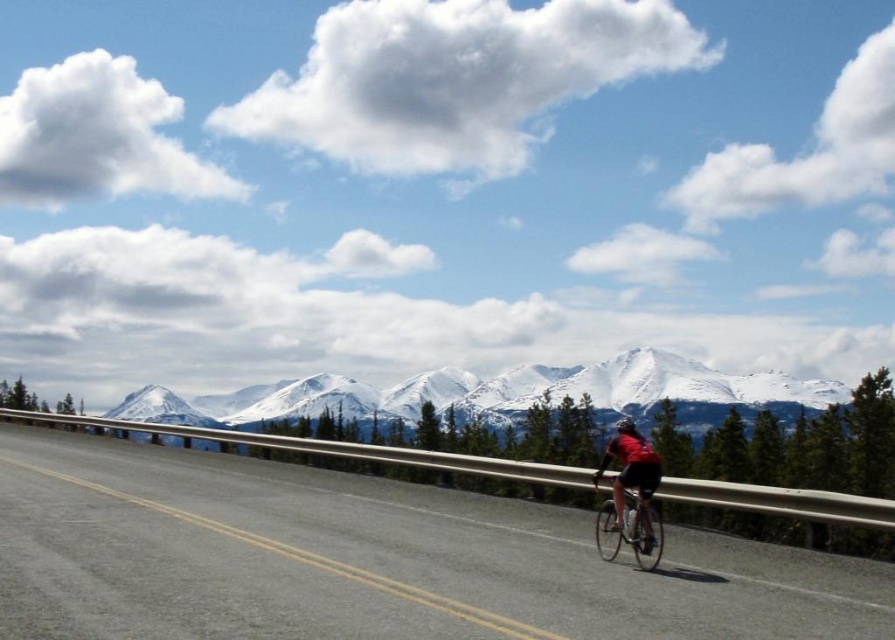
You are a photographer trying to capture the cyclist in the scene. You notice the red fabric cyclist at center and the shiny black helmet at center. Which object appears narrower in the photo?

The red fabric cyclist at center appears narrower than the shiny black helmet at center in the photo.

You are a photographer standing at the camera position in the scene. You want to capture a photo of the snowy granite mountains at upper center. However, you need to ensure that the mountains are at least 100 meters away from your position to avoid distortion. Is the distance sufficient?

The distance between the snowy granite mountains at upper center and the camera is 305.06 feet, which is approximately 93 meters. Since 93 meters is less than 100 meters, the distance is insufficient to avoid distortion.